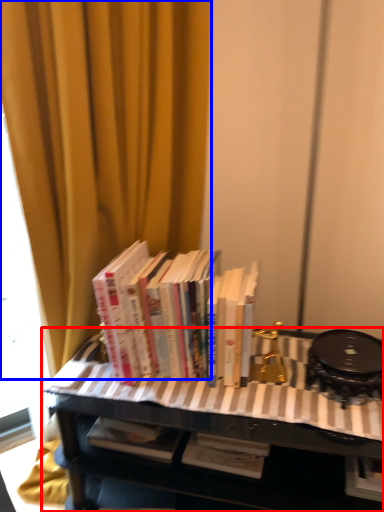
Question: Which object is closer to the camera taking this photo, table (highlighted by a red box) or curtain (highlighted by a blue box)?

Choices:
 (A) table
 (B) curtain

Answer: (B)